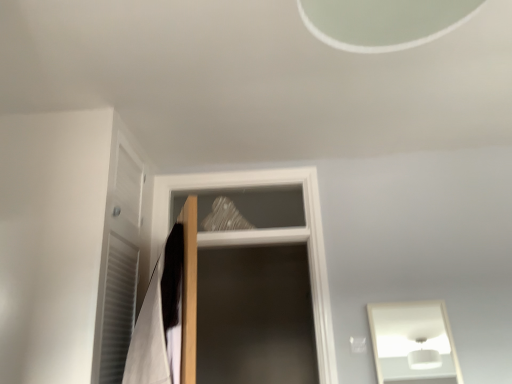
What do you see at coordinates (160, 320) in the screenshot? The image size is (512, 384). I see `white fabric laundry at left` at bounding box center [160, 320].

Measure the distance between point (176, 286) and camera.

Point (176, 286) and camera are 5.27 feet apart from each other.

Find the location of a particular element. white fabric laundry at left is located at coordinates (160, 320).

Find the location of a particular element. The width and height of the screenshot is (512, 384). white fabric laundry at left is located at coordinates (160, 320).